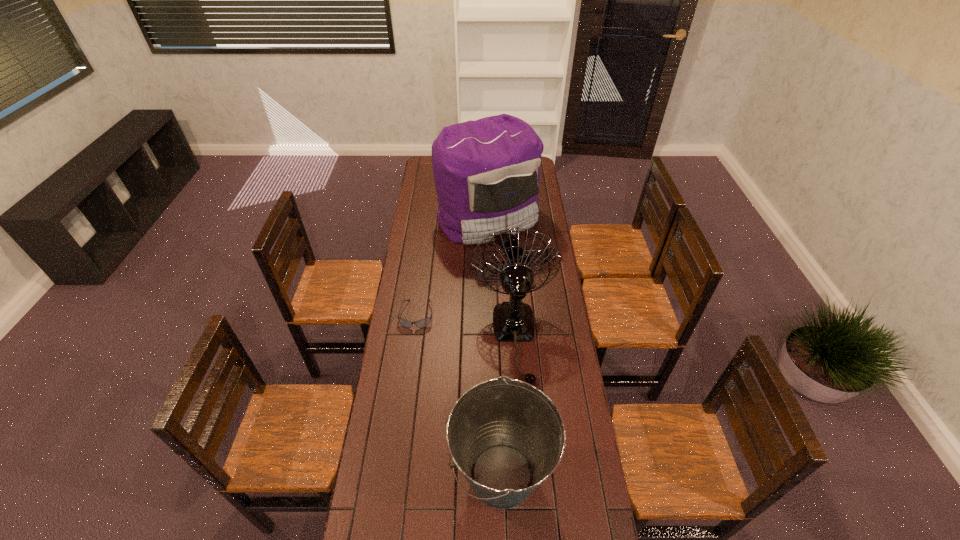
Where is `free space located on the lenses of the sunglasses`? Image resolution: width=960 pixels, height=540 pixels. free space located on the lenses of the sunglasses is located at coordinates (404, 409).

At what (x,y) coordinates should I click in order to perform the action: click on backpack situated at the left edge. Please return your answer as a coordinate pair (x, y). The height and width of the screenshot is (540, 960). Looking at the image, I should click on (487, 172).

Locate an element on the screen. sunglasses that is positioned at the left edge is located at coordinates (425, 322).

Where is `backpack that is at the right edge`? backpack that is at the right edge is located at coordinates (487, 172).

The image size is (960, 540). Find the location of `fan at the right edge`. fan at the right edge is located at coordinates (513, 321).

Where is `bucket that is at the right edge`? The width and height of the screenshot is (960, 540). bucket that is at the right edge is located at coordinates (x=507, y=437).

Where is `vacant space at the left edge of the desktop`? This screenshot has height=540, width=960. vacant space at the left edge of the desktop is located at coordinates (420, 261).

In the image, there is a desktop. Where is `vacant space at the right edge`? Image resolution: width=960 pixels, height=540 pixels. vacant space at the right edge is located at coordinates (563, 346).

The image size is (960, 540). I want to click on vacant space in between the farthest object and the third tallest object, so tap(494, 347).

Locate an element on the screen. Image resolution: width=960 pixels, height=540 pixels. vacant region between the shortest object and the bucket is located at coordinates tap(459, 395).